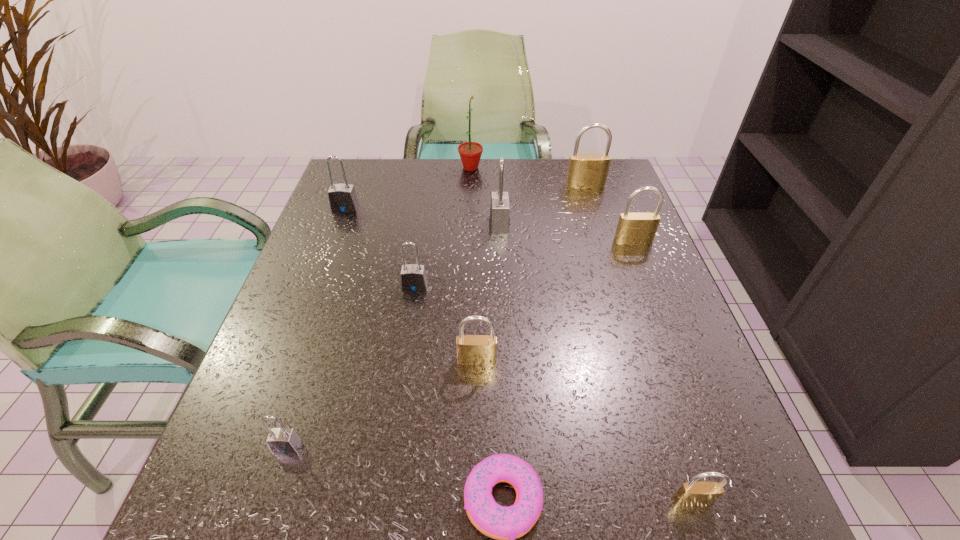
Find the location of a particular element. This screenshot has width=960, height=540. object located at the far left corner is located at coordinates (342, 198).

The image size is (960, 540). What are the coordinates of `object that is positioned at the far right corner` in the screenshot? It's located at (585, 171).

Locate an element on the screen. Image resolution: width=960 pixels, height=540 pixels. object that is positioned at the near right corner is located at coordinates (692, 493).

In the image, there is a desktop. Find the location of `vacant area at the far edge`. vacant area at the far edge is located at coordinates (475, 205).

Where is `vacant region at the near edge`? The width and height of the screenshot is (960, 540). vacant region at the near edge is located at coordinates (581, 495).

Where is `vacant space at the left edge`? This screenshot has height=540, width=960. vacant space at the left edge is located at coordinates 375,244.

This screenshot has width=960, height=540. In order to click on vacant area at the right edge in this screenshot , I will do `click(645, 287)`.

You are a GUI agent. You are given a task and a screenshot of the screen. Output one action in this format:
    pyautogui.click(x=<x>, y=<y>)
    Task: Click on the vacant space at the near left corner of the desktop
    The width and height of the screenshot is (960, 540).
    Given the screenshot: What is the action you would take?
    pyautogui.click(x=284, y=518)

Identify the location of vacant space at the far right corner of the desktop. (585, 199).

Locate an element on the screen. vacant space that is in between the seventh farthest padlock and the tallest object is located at coordinates (378, 307).